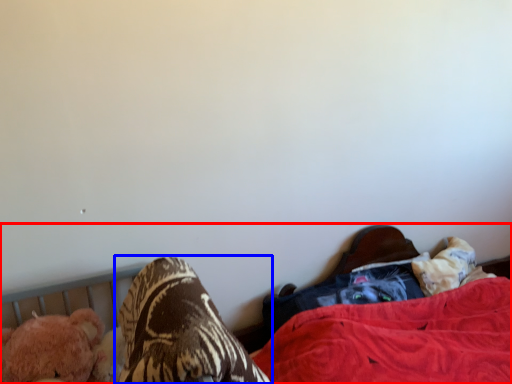
Question: Which of the following is the closest to the observer, bed (highlighted by a red box) or footwear (highlighted by a blue box)?

Choices:
 (A) bed
 (B) footwear

Answer: (B)